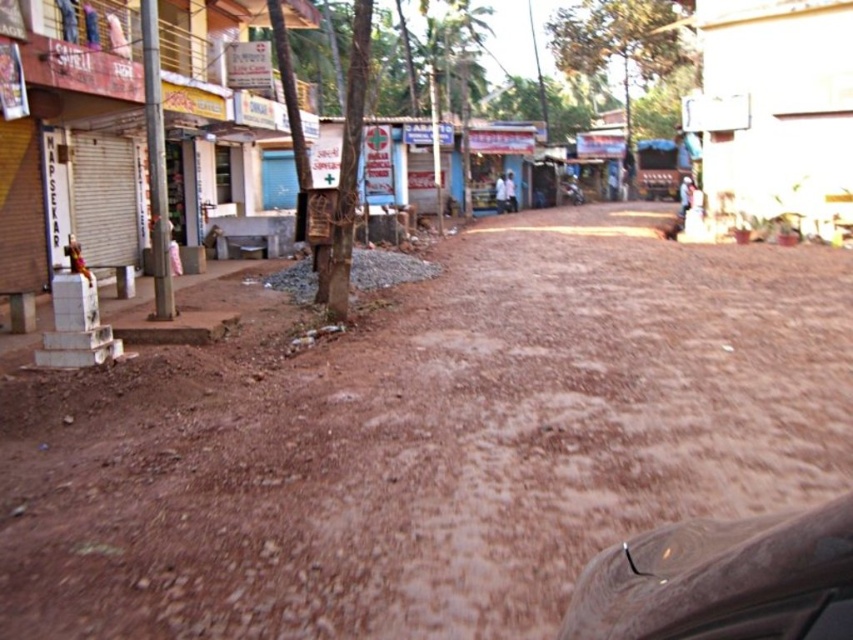
Question: Among these points, which one is nearest to the camera?

Choices:
 (A) (310, 438)
 (B) (695, 547)

Answer: (B)

Question: Which point appears farthest from the camera in this image?

Choices:
 (A) 636,298
 (B) 677,612

Answer: (A)

Question: Among these points, which one is nearest to the camera?

Choices:
 (A) (494, 314)
 (B) (686, 561)

Answer: (B)

Question: Observing the image, what is the correct spatial positioning of brown dusty ground at center in reference to shiny metallic car at lower right?

Choices:
 (A) below
 (B) above

Answer: (B)

Question: Is brown dusty ground at center bigger than shiny metallic car at lower right?

Choices:
 (A) no
 (B) yes

Answer: (B)

Question: Is brown dusty ground at center bigger than shiny metallic car at lower right?

Choices:
 (A) yes
 (B) no

Answer: (A)